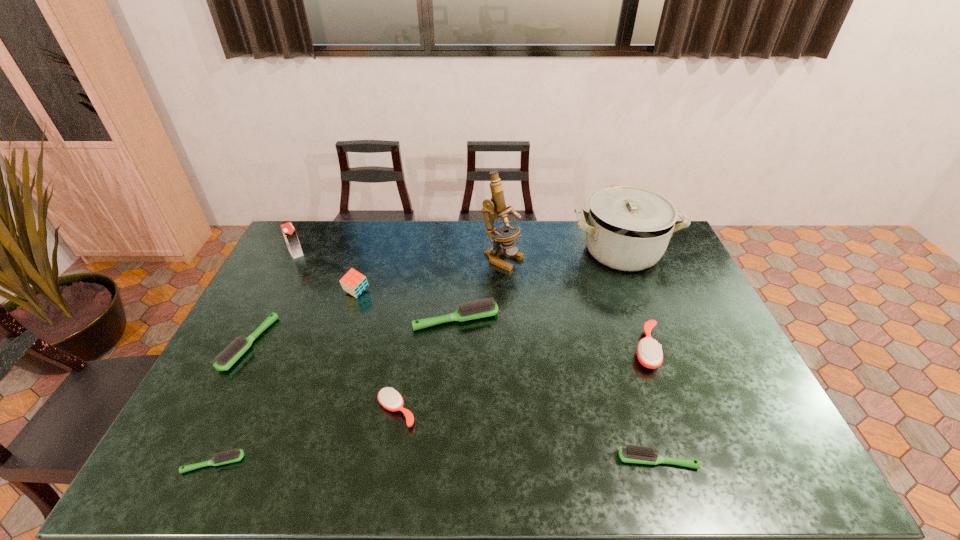
Locate an element on the screen. The height and width of the screenshot is (540, 960). free space located on the left of the red cube is located at coordinates (293, 293).

I want to click on free spot located on the left of the bigger orange hairbrush, so click(587, 349).

You are a GUI agent. You are given a task and a screenshot of the screen. Output one action in this format:
    pyautogui.click(x=<x>, y=<y>)
    Task: Click on the vacant space located on the right of the biggest light hairbrush
    The image size is (960, 540).
    Given the screenshot: What is the action you would take?
    point(565,319)

In order to click on free location located on the back of the second biggest light hairbrush in this screenshot , I will do `click(300, 244)`.

The image size is (960, 540). In order to click on free location located on the left of the fourth farthest hairbrush in this screenshot , I will do `click(252, 411)`.

This screenshot has height=540, width=960. I want to click on blank space located on the back of the fifth tallest hairbrush, so click(x=648, y=430).

Identify the location of free space located on the right of the shortest object. The height and width of the screenshot is (540, 960). (354, 463).

Locate an element on the screen. microscope located in the far edge section of the desktop is located at coordinates coord(497,203).

At what (x,y) coordinates should I click in order to perform the action: click on saucepan that is at the far edge. Please return your answer as a coordinate pair (x, y). Looking at the image, I should click on (628, 227).

In order to click on orange juice that is at the far edge in this screenshot , I will do 289,232.